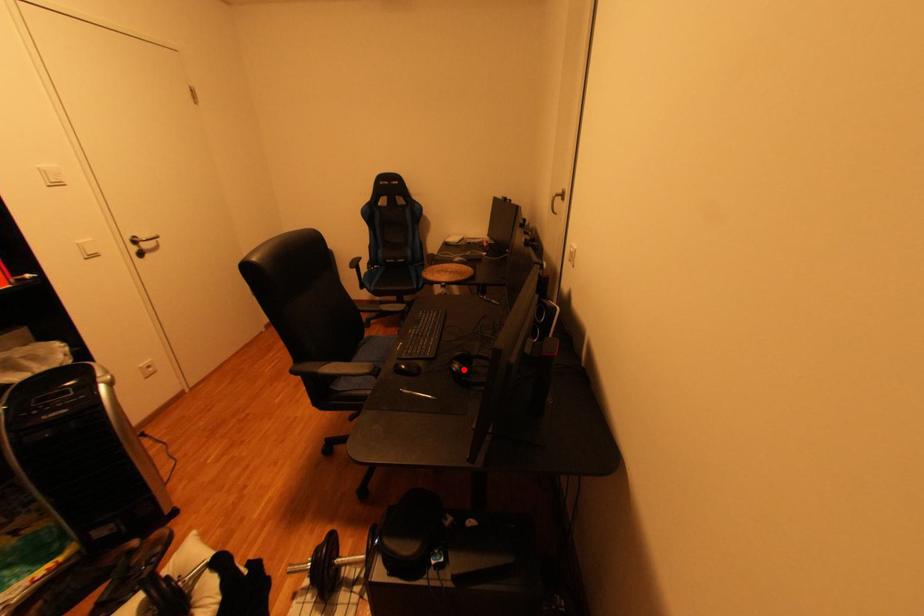
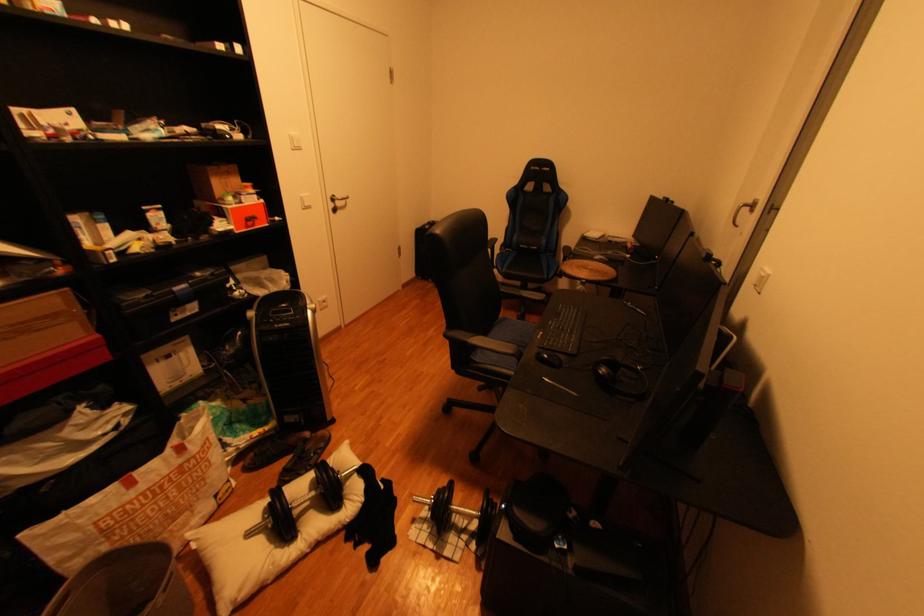
Find the pixel in the second image that matches the highlighted location in the first image.

(611, 373)